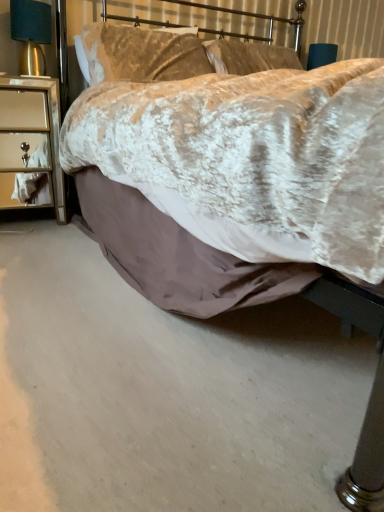
In order to click on free space in front of silver mirrored nightstand at left in this screenshot , I will do `click(31, 236)`.